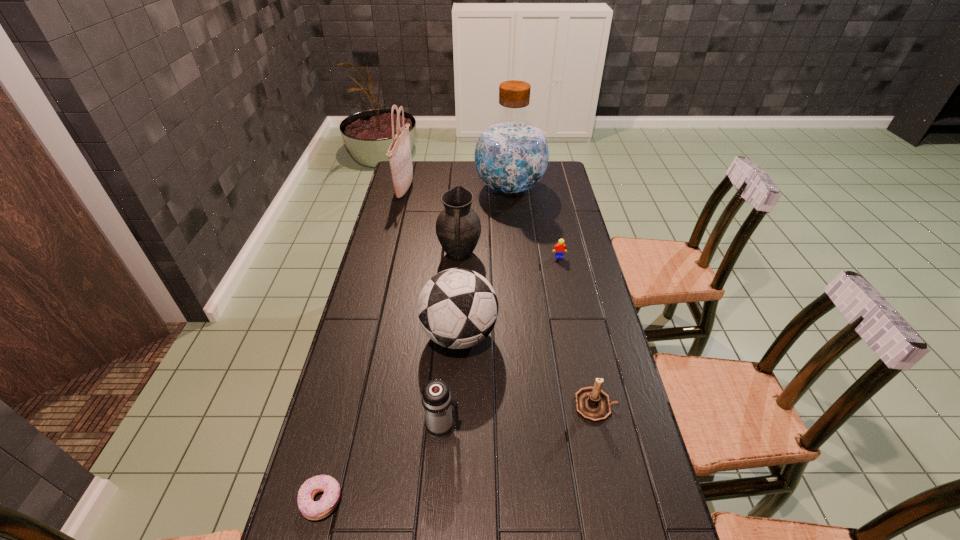
Identify the location of water jug. (511, 155).

Locate an element on the screen. This screenshot has height=540, width=960. the seventh shortest object is located at coordinates (400, 159).

Locate an element on the screen. This screenshot has height=540, width=960. pitcher is located at coordinates (458, 227).

The width and height of the screenshot is (960, 540). I want to click on soccer ball, so click(457, 308).

This screenshot has width=960, height=540. Identify the location of thermos bottle. (436, 399).

Find the location of a particular element. This screenshot has width=960, height=540. the third shortest object is located at coordinates (593, 404).

Locate an element on the screen. the second shortest object is located at coordinates (x=560, y=248).

This screenshot has width=960, height=540. I want to click on the nearest object, so click(x=317, y=510).

Locate an element on the screen. This screenshot has width=960, height=540. doughnut is located at coordinates (317, 510).

Identify the location of vacant space situated on the front of the tallest object. (516, 257).